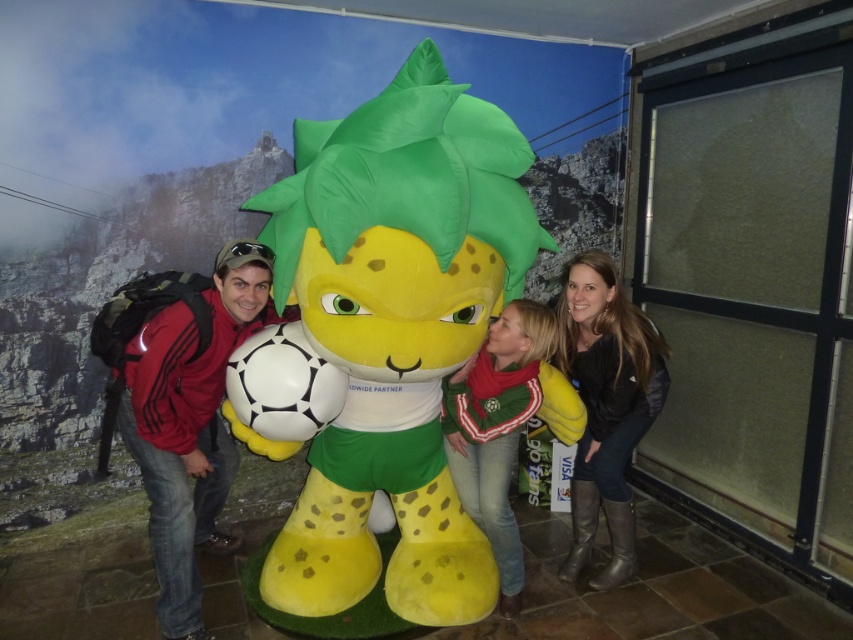
Based on the photo, you are a photographer setting up a photo shoot with the three people and the mascot. You need to place a large banner behind them. The banner is 2 meters wide. The matte black jacket at lower right and green jersey at center are in the frame. Which object should the banner be placed closer to so that it doesn

The banner should be placed closer to the green jersey at center because the matte black jacket at lower right is bigger than the green jersey at center, so the smaller object would need the banner closer to maintain visual balance.

You are a photographer trying to capture a clear photo of the green jersey at center and the matte black jacket at lower right. Which object should you focus on first to ensure both are in focus?

The green jersey at center is behind matte black jacket at lower right, so you should focus on the matte black jacket at lower right first to ensure both are in focus.

You are standing at the point marked as point (587, 284) in the image. You want to take a photo of the mascot and the mountain in the background. Is the distance from your current position to the camera sufficient to capture both the mascot and the mountain in the frame?

The distance of point (587, 284) from camera is 2.49 meters. Since the mountain is part of the background mural, it is already in the scene and does not require additional distance. Therefore, you can capture both the mascot and the mountain in the frame from your current position.